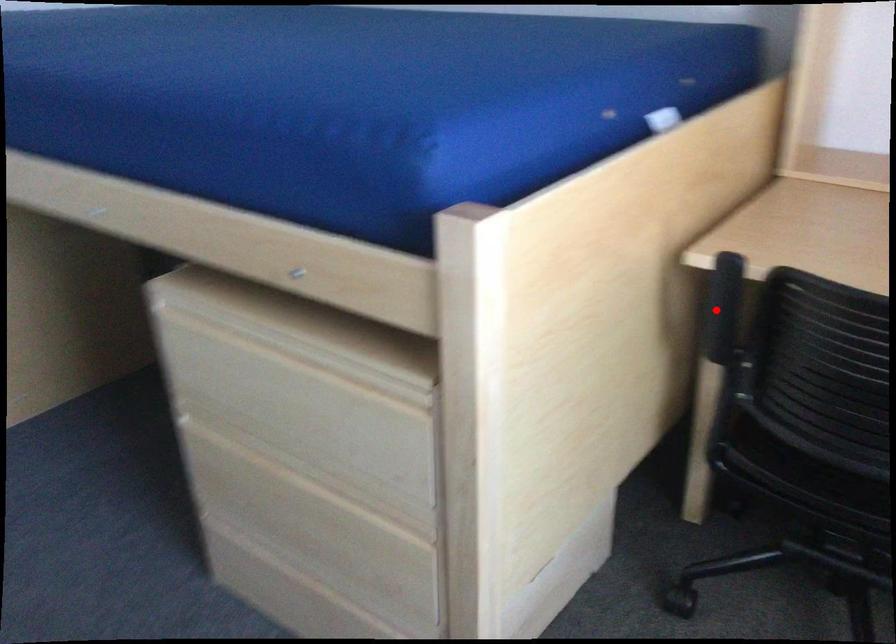
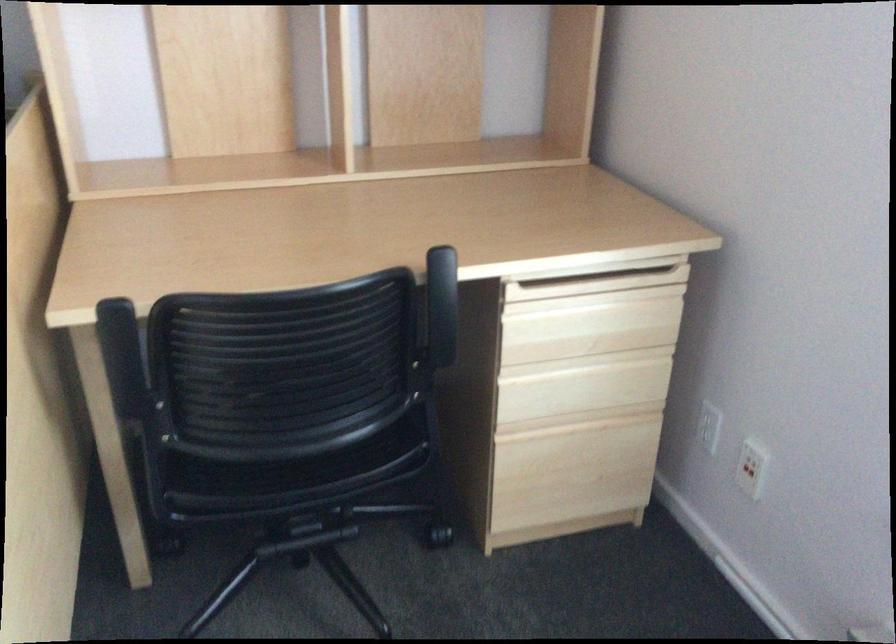
Where in the second image is the point corresponding to the highlighted location from the first image?

(123, 360)